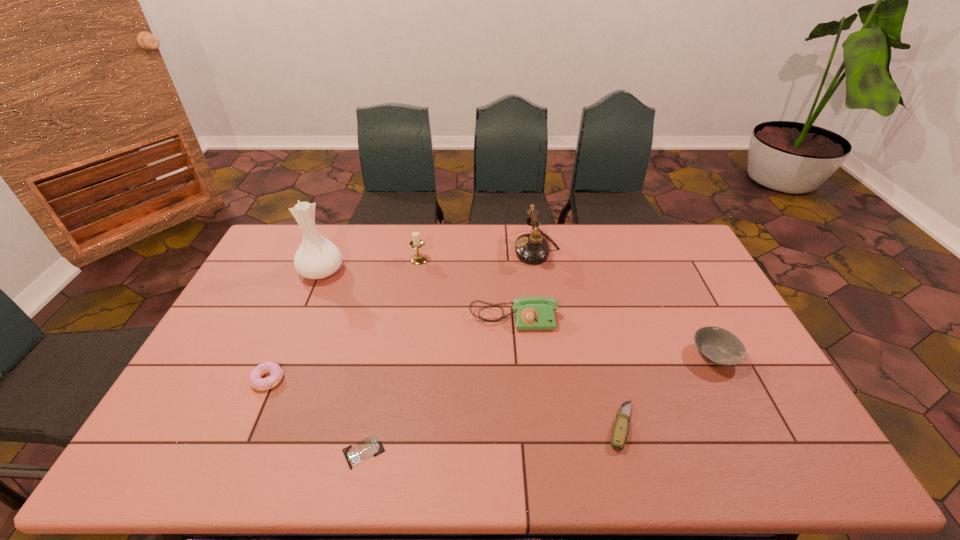
You are a GUI agent. You are given a task and a screenshot of the screen. Output one action in this format:
    pyautogui.click(x=<x>, y=<y>)
    Task: Click on the vacant space that satisfies the following two spatial constraints: 1. on the dial of the taller telephone; 2. on the front side of the shortest object
    
    Given the screenshot: What is the action you would take?
    pyautogui.click(x=569, y=452)

Where is `free region that satisfies the following two spatial constraints: 1. on the dial of the taller telephone; 2. on the dial of the fifth shortest object`? free region that satisfies the following two spatial constraints: 1. on the dial of the taller telephone; 2. on the dial of the fifth shortest object is located at coordinates (548, 319).